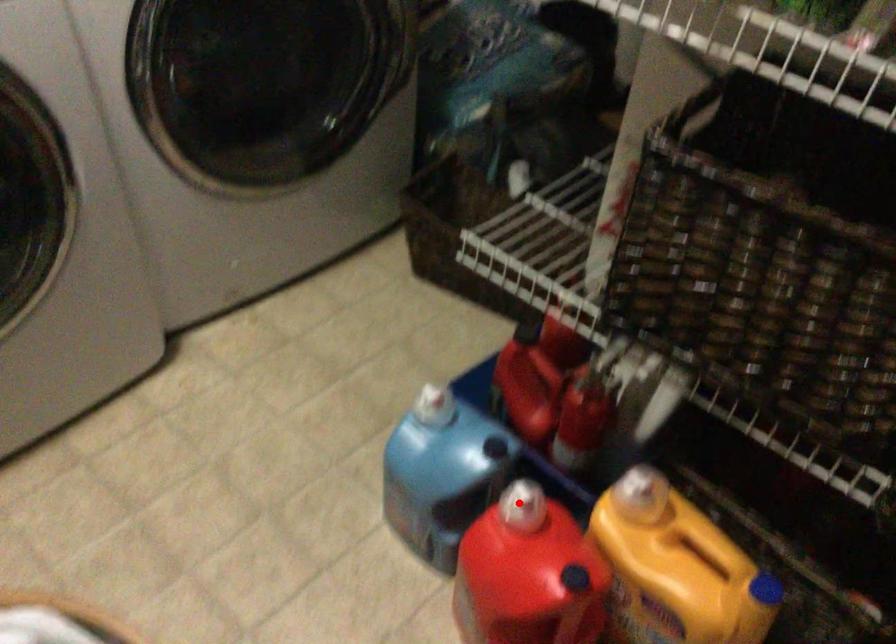
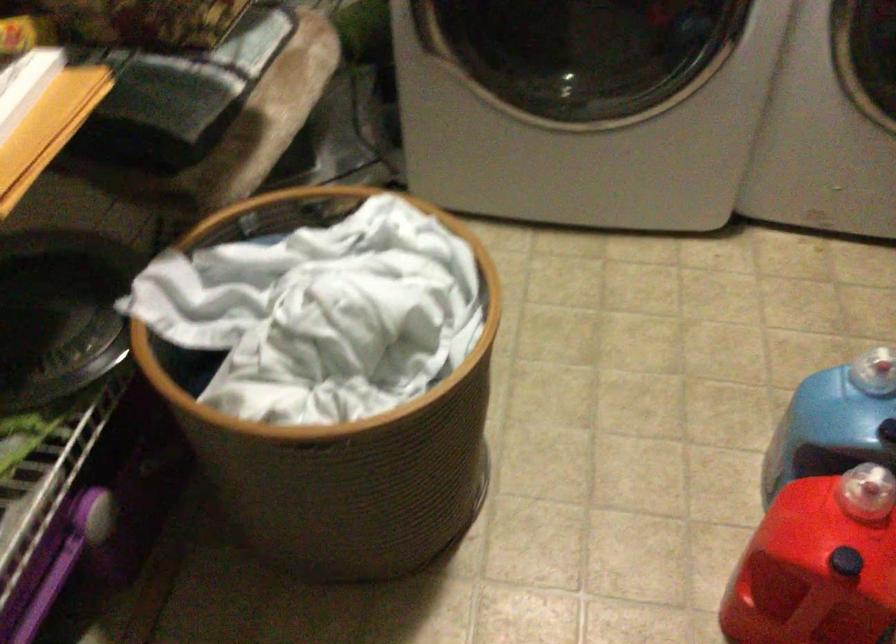
Locate, in the second image, the point that corresponds to the highlighted location in the first image.

(866, 491)